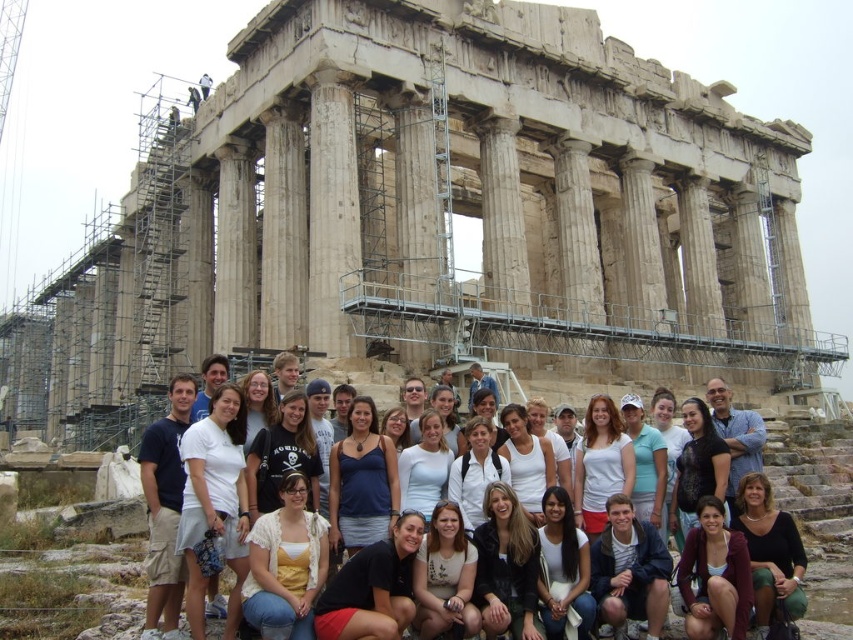
You are standing in front of the Parthenon and notice two items at the center of the image. Which one is positioned to the left when viewed from your perspective? The two items are the stone columns at center and the white cotton shirt at center.

The stone columns at center are to the left of the white cotton shirt at center, so the stone columns at center are positioned to the left.